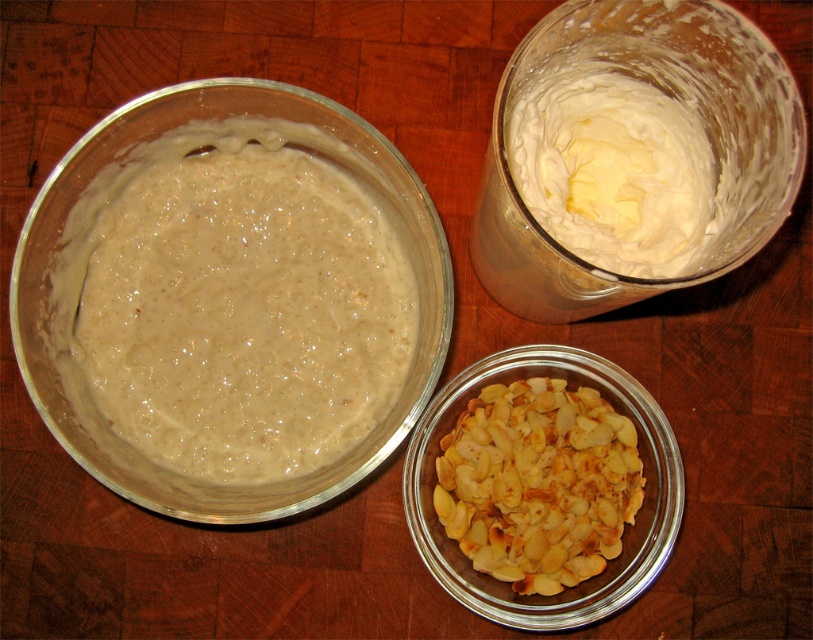
You are a baker preparing a dessert and need to place the golden toasted almonds at lower center and the white creamy butter at upper right on a shelf. The shelf has limited vertical space. Which item should you place higher to ensure both fit without overlapping?

The white creamy butter at upper right should be placed higher since the golden toasted almonds at lower center is below it, allowing both to fit without overlapping.

You are standing in front of the three glass containers. You notice two points marked in the image. The first point is at coordinates point (281, 246) and the second point is at point (438, 444). Which of these two points is nearer to you?

Point (281, 246) is closer to the viewer than point (438, 444).

You are a baker preparing a dessert and need to know the sizes of the ingredients. Which of the two items, the golden toasted almonds at lower center or the white creamy butter at upper right, is smaller in size?

The golden toasted almonds at lower center is smaller than the white creamy butter at upper right.